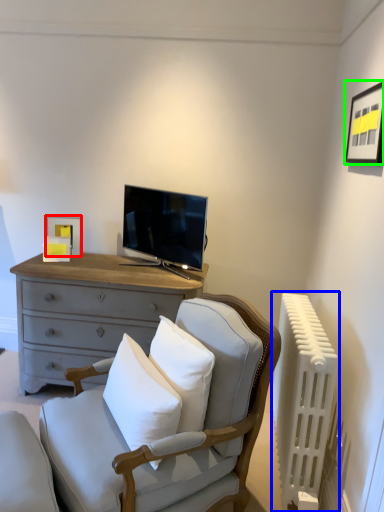
Question: Estimate the real-world distances between objects in this image. Which object is closer to picture frame (highlighted by a red box), radiator (highlighted by a blue box) or picture frame (highlighted by a green box)?

Choices:
 (A) radiator
 (B) picture frame

Answer: (A)